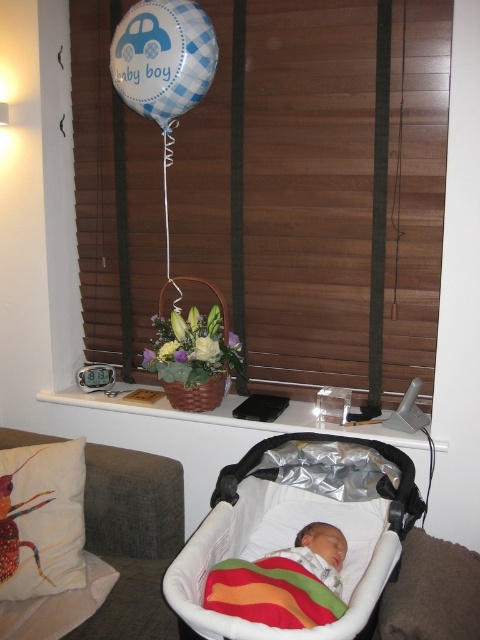
Question: Does blue checkered balloon at upper center have a lesser width compared to rainbow striped fabric at center?

Choices:
 (A) no
 (B) yes

Answer: (A)

Question: Does white fabric cushion with colorful insect design at lower left have a greater width compared to blue checkered balloon at upper center?

Choices:
 (A) no
 (B) yes

Answer: (A)

Question: Which point is closer to the camera?

Choices:
 (A) soft white swaddle at center
 (B) white fabric cushion with colorful insect design at lower left
 (C) blue checkered balloon at upper center

Answer: (A)

Question: Is white fabric baby carriage at lower center thinner than rainbow striped fabric at center?

Choices:
 (A) yes
 (B) no

Answer: (B)

Question: Which point appears farthest from the camera in this image?

Choices:
 (A) (392, 451)
 (B) (326, 532)

Answer: (A)

Question: Which of the following is the closest to the observer?

Choices:
 (A) (124, 65)
 (B) (82, 451)
 (C) (303, 624)
 (D) (319, 579)

Answer: (C)